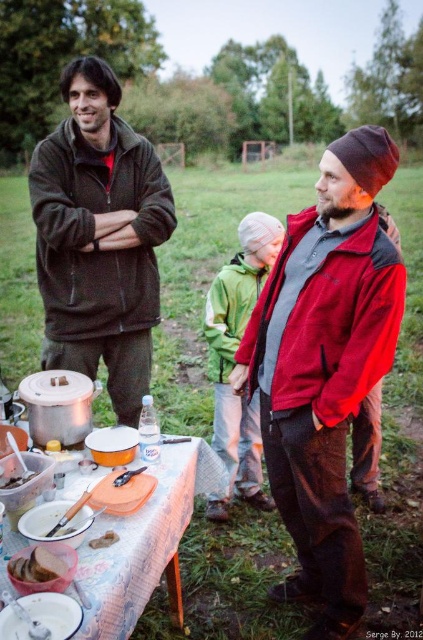
Question: Is orange plastic tray at center further to camera compared to brown matte clay pot at center?

Choices:
 (A) yes
 (B) no

Answer: (B)

Question: Among these points, which one is nearest to the camera?

Choices:
 (A) (102, 536)
 (B) (294, 243)
 (C) (46, 552)
 (D) (10, 483)

Answer: (C)

Question: Does red fleece jacket at center appear on the right side of white matte plate at lower left?

Choices:
 (A) yes
 (B) no

Answer: (A)

Question: Is smooth brown bread at center positioned at the back of brown matte clay pot at center?

Choices:
 (A) yes
 (B) no

Answer: (B)

Question: Which of these objects is positioned farthest from the brown matte clay pot at center?

Choices:
 (A) smooth brown bread at center
 (B) white matte plate at lower left
 (C) dark brown fleece jacket at left
 (D) brown matte clay pot at lower left

Answer: (C)

Question: Which of the following is the farthest from the observer?

Choices:
 (A) dark brown fleece jacket at left
 (B) smooth brown bread at center
 (C) brown matte clay pot at lower left
 (D) red fleece jacket at center

Answer: (A)